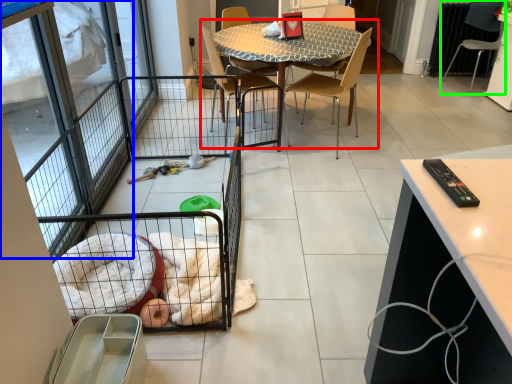
Question: Based on their relative distances, which object is farther from kitchen & dining room table (highlighted by a red box)? Choose from screen door (highlighted by a blue box) and chair (highlighted by a green box).

Choices:
 (A) screen door
 (B) chair

Answer: (B)